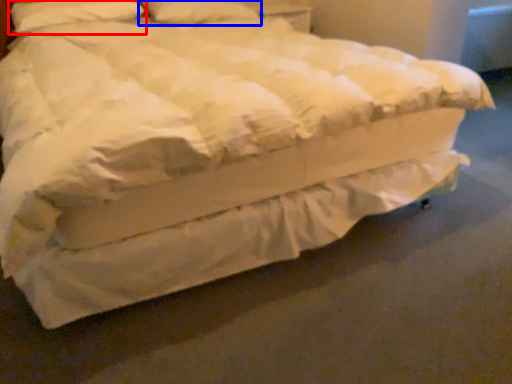
Question: Which point is further to the camera, pillow (highlighted by a red box) or pillow (highlighted by a blue box)?

Choices:
 (A) pillow
 (B) pillow

Answer: (B)